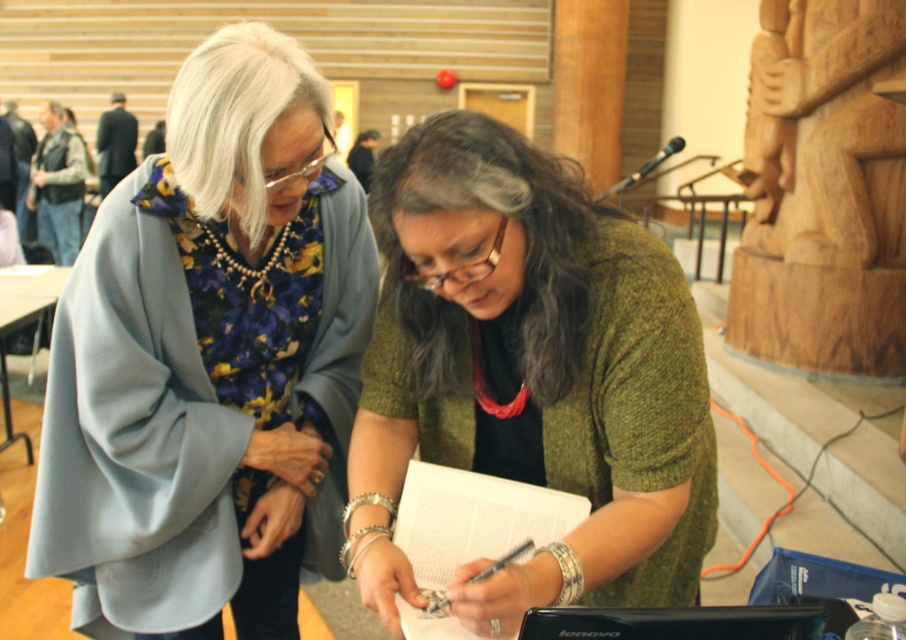
You are standing in the conference hall and see two points marked in the image. Which point, point (x=601, y=465) or point (x=498, y=564), is closer to you?

Point (x=601, y=465) is further to the camera than point (x=498, y=564), so the point closer to you is point (x=498, y=564).

You are standing at the entrance of the conference hall and see the matte blue coat at center. If you walk straight towards the coat, will you reach it before the staircase?

The question cannot be answered with the provided information because the position of the staircase relative to the matte blue coat at center is not mentioned in the scene description or object details.

You are a photographer at the event and want to capture a photo of both the matte blue coat at center and the green knitted sweater at center. Which one should you focus on first to ensure the taller object is in sharp focus?

The matte blue coat at center is taller than the green knitted sweater at center, so you should focus on the matte blue coat at center first to ensure it is in sharp focus.